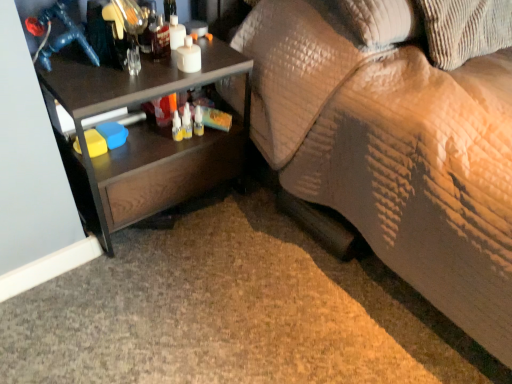
Question: Could brown corduroy pillow at upper right be considered to be inside textured beige couch at lower right?

Choices:
 (A) yes
 (B) no

Answer: (A)

Question: From the image's perspective, is textured beige couch at lower right beneath brown corduroy pillow at upper right?

Choices:
 (A) no
 (B) yes

Answer: (B)

Question: Are textured beige couch at lower right and brown corduroy pillow at upper right located far from each other?

Choices:
 (A) no
 (B) yes

Answer: (A)

Question: Is the surface of textured beige couch at lower right in direct contact with brown corduroy pillow at upper right?

Choices:
 (A) no
 (B) yes

Answer: (A)

Question: Can we say textured beige couch at lower right lies outside brown corduroy pillow at upper right?

Choices:
 (A) yes
 (B) no

Answer: (A)

Question: Based on their sizes in the image, would you say textured beige couch at lower right is bigger or smaller than brown corduroy pillow at upper right?

Choices:
 (A) big
 (B) small

Answer: (A)

Question: Looking at their shapes, would you say textured beige couch at lower right is wider or thinner than brown corduroy pillow at upper right?

Choices:
 (A) wide
 (B) thin

Answer: (A)

Question: Does point (433, 104) appear closer or farther from the camera than point (448, 31)?

Choices:
 (A) closer
 (B) farther

Answer: (A)

Question: In terms of height, does textured beige couch at lower right look taller or shorter compared to brown corduroy pillow at upper right?

Choices:
 (A) short
 (B) tall

Answer: (B)

Question: Is brown corduroy pillow at upper right spatially inside textured beige couch at lower right, or outside of it?

Choices:
 (A) inside
 (B) outside

Answer: (A)

Question: From the image's perspective, is brown corduroy pillow at upper right positioned above or below textured beige couch at lower right?

Choices:
 (A) above
 (B) below

Answer: (A)

Question: In terms of height, does brown corduroy pillow at upper right look taller or shorter compared to textured beige couch at lower right?

Choices:
 (A) tall
 (B) short

Answer: (B)

Question: Looking at the image, does brown corduroy pillow at upper right seem bigger or smaller compared to textured beige couch at lower right?

Choices:
 (A) big
 (B) small

Answer: (B)

Question: From the image's perspective, is brown corduroy pillow at upper right positioned above or below dark wood desk at left?

Choices:
 (A) above
 (B) below

Answer: (A)

Question: Considering the positions of brown corduroy pillow at upper right and dark wood desk at left in the image, is brown corduroy pillow at upper right wider or thinner than dark wood desk at left?

Choices:
 (A) wide
 (B) thin

Answer: (A)